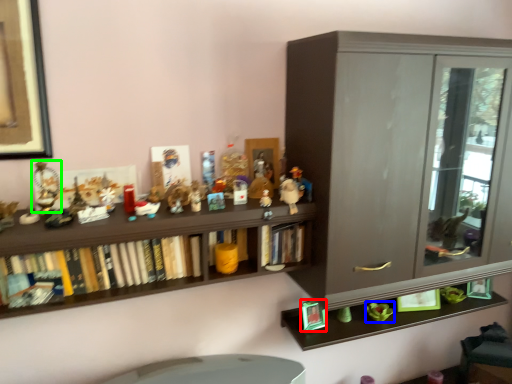
Question: Which object is the closest to the toy (highlighted by a red box)? Choose among these: toy (highlighted by a blue box) or toy (highlighted by a green box).

Choices:
 (A) toy
 (B) toy

Answer: (A)